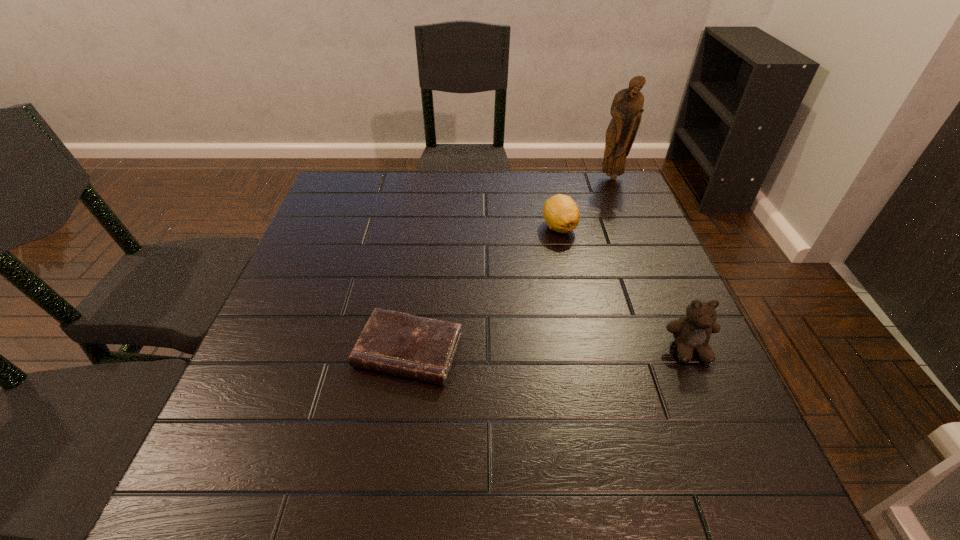
Locate an element on the screen. The image size is (960, 540). the leftmost object is located at coordinates (395, 343).

Image resolution: width=960 pixels, height=540 pixels. In order to click on the shortest object in this screenshot , I will do [x=395, y=343].

Locate an element on the screen. teddy bear is located at coordinates (692, 332).

Where is `the second farthest object`? the second farthest object is located at coordinates (561, 213).

Locate an element on the screen. The height and width of the screenshot is (540, 960). the second object from left to right is located at coordinates (561, 213).

Locate an element on the screen. the farthest object is located at coordinates (626, 110).

Locate an element on the screen. This screenshot has height=540, width=960. the tallest object is located at coordinates (626, 110).

Find the location of a particular element. Image resolution: width=960 pixels, height=540 pixels. vacant space situated on the right of the shortest object is located at coordinates (635, 352).

Identify the location of vacant space situated 0.050m on the face of the third shortest object. (706, 389).

Where is `vacant space located 0.240m at the stem end of the third nearest object`? The height and width of the screenshot is (540, 960). vacant space located 0.240m at the stem end of the third nearest object is located at coordinates (558, 307).